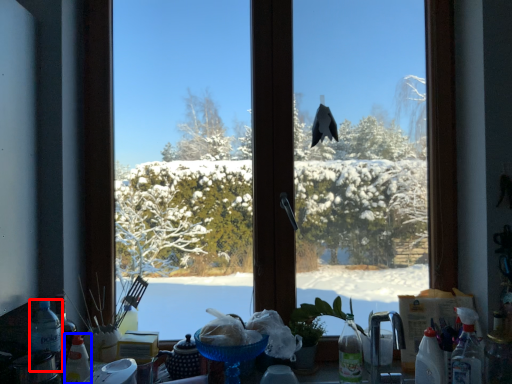
Question: Which object is closer to the camera taking this photo, bottle (highlighted by a red box) or bottle (highlighted by a blue box)?

Choices:
 (A) bottle
 (B) bottle

Answer: (B)